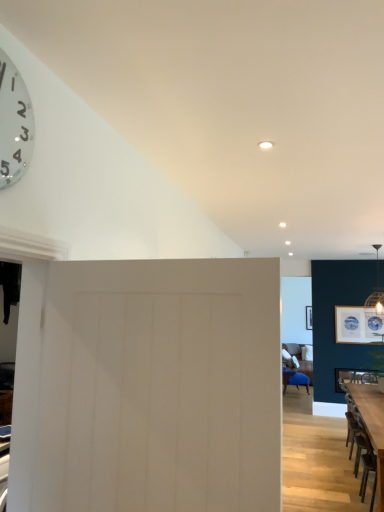
Question: Can you confirm if white matte door at center is bigger than matte white picture frame at upper right?

Choices:
 (A) yes
 (B) no

Answer: (A)

Question: Can you confirm if white matte door at center is positioned to the right of matte white picture frame at upper right?

Choices:
 (A) no
 (B) yes

Answer: (A)

Question: Is white matte door at center taller than matte white picture frame at upper right?

Choices:
 (A) yes
 (B) no

Answer: (A)

Question: Is white matte door at center completely or partially outside of matte white picture frame at upper right?

Choices:
 (A) no
 (B) yes

Answer: (B)

Question: From a real-world perspective, is white matte door at center physically below matte white picture frame at upper right?

Choices:
 (A) no
 (B) yes

Answer: (B)

Question: Does white matte door at center come behind matte white picture frame at upper right?

Choices:
 (A) yes
 (B) no

Answer: (B)

Question: Is metallic silver clock at upper left shorter than white matte door at center?

Choices:
 (A) yes
 (B) no

Answer: (A)

Question: Does metallic silver clock at upper left turn towards white matte door at center?

Choices:
 (A) yes
 (B) no

Answer: (B)

Question: Is metallic silver clock at upper left outside white matte door at center?

Choices:
 (A) yes
 (B) no

Answer: (A)

Question: Does metallic silver clock at upper left appear on the right side of white matte door at center?

Choices:
 (A) no
 (B) yes

Answer: (A)

Question: Is metallic silver clock at upper left bigger than white matte door at center?

Choices:
 (A) yes
 (B) no

Answer: (B)

Question: From the image's perspective, would you say metallic silver clock at upper left is shown under white matte door at center?

Choices:
 (A) yes
 (B) no

Answer: (B)

Question: Is wooden table at lower right thinner than metallic silver clock at upper left?

Choices:
 (A) no
 (B) yes

Answer: (A)